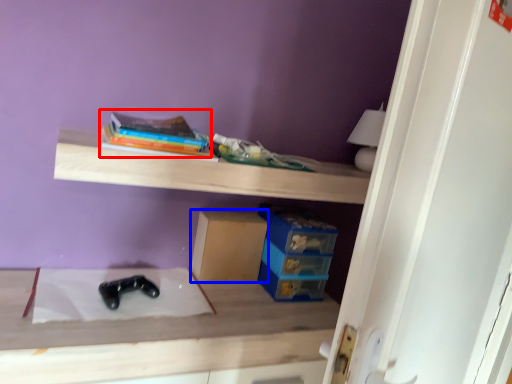
Question: Which object is closer to the camera taking this photo, book (highlighted by a red box) or cardboard box (highlighted by a blue box)?

Choices:
 (A) book
 (B) cardboard box

Answer: (A)